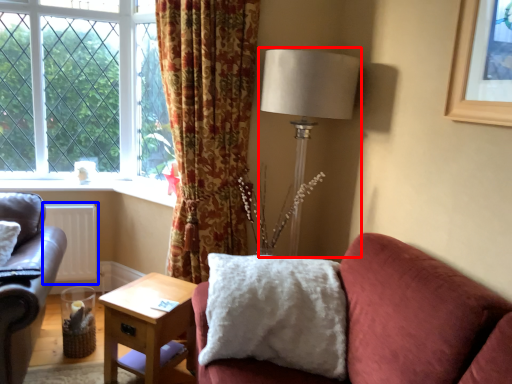
Question: Which of the following is the closest to the observer, table lamp (highlighted by a red box) or radiator (highlighted by a blue box)?

Choices:
 (A) table lamp
 (B) radiator

Answer: (A)